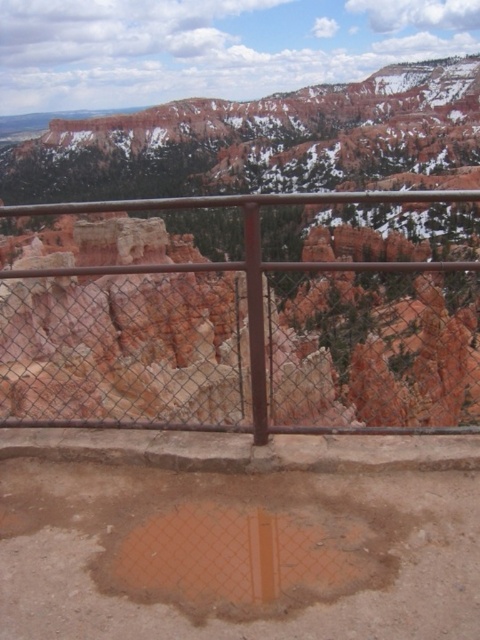
You are a park ranger checking the viewing area. You see the rusty metal fence at center and the brown matte puddle at lower center. Which object is closer to the left side of the image?

The rusty metal fence at center is to the left of the brown matte puddle at lower center, so it is closer to the left side of the image.

You are a park ranger planning to place a warning sign about slippery conditions. The sign must be placed where both the rusty metal fence at center and the brown matte puddle at lower center are visible. Based on their sizes, which object should the sign be closer to to ensure both are in view?

The sign should be placed closer to the brown matte puddle at lower center because the rusty metal fence at center is larger and can be seen from a greater distance, while the smaller puddle requires closer proximity to be noticed.